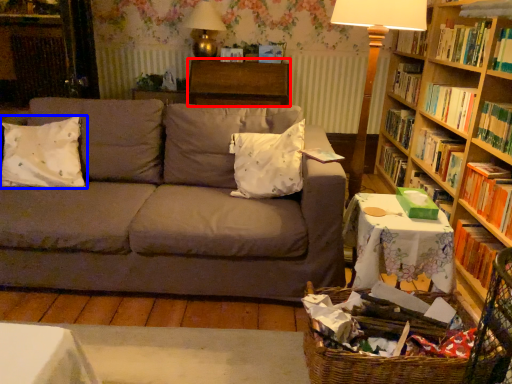
Question: Which point is closer to the camera, table (highlighted by a red box) or pillow (highlighted by a blue box)?

Choices:
 (A) table
 (B) pillow

Answer: (B)